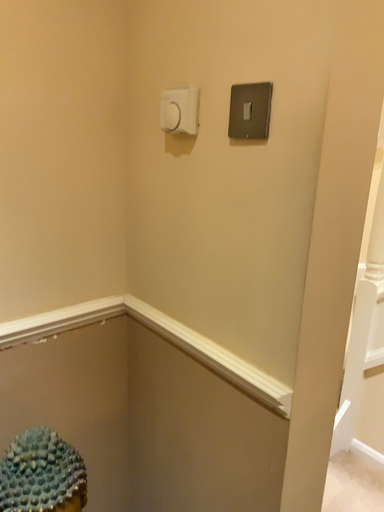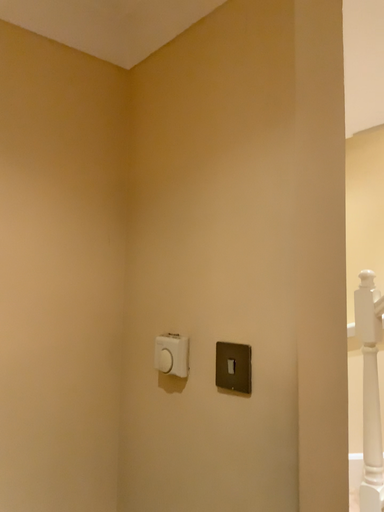
Question: How did the camera likely rotate when shooting the video?

Choices:
 (A) rotated upward
 (B) rotated downward

Answer: (A)